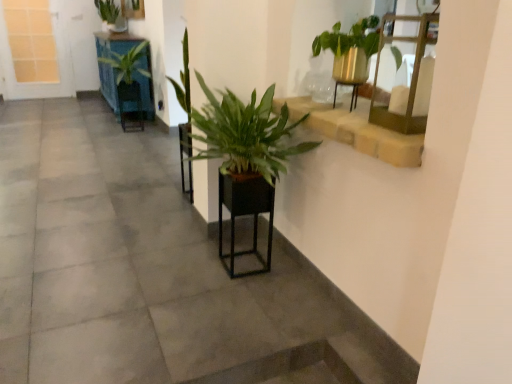
What do you see at coordinates (124, 71) in the screenshot? The image size is (512, 384). I see `green leafy plant at upper left, which ranks as the 2th houseplant in top-to-bottom order` at bounding box center [124, 71].

In the scene shown: What is the approximate width of stone textured window sill at upper right?

The width of stone textured window sill at upper right is 47.21 centimeters.

Find the location of a particular element. stone textured window sill at upper right is located at coordinates (356, 131).

Locate an element on the screen. The height and width of the screenshot is (384, 512). smooth concrete at center is located at coordinates (145, 271).

Where is `black matte planter at center, the 3th armchair positioned from the back`? The height and width of the screenshot is (384, 512). black matte planter at center, the 3th armchair positioned from the back is located at coordinates (246, 214).

Image resolution: width=512 pixels, height=384 pixels. Describe the element at coordinates (246, 214) in the screenshot. I see `black matte planter at center, which is the 3th armchair in top-to-bottom order` at that location.

I want to click on green matte plant at center, arranged as the 2th armchair when ordered from the bottom, so click(x=187, y=155).

Does point (243, 370) appear closer or farther from the camera than point (306, 146)?

Point (243, 370) appears to be closer to the viewer than point (306, 146).

From a real-world perspective, which object stands above the other?

green leafy plant at center, acting as the 3th houseplant starting from the back, from a real-world perspective.

Is brown wooden stairwell at lower center bigger than green leafy plant at center, which ranks as the third houseplant in top-to-bottom order?

Actually, brown wooden stairwell at lower center might be smaller than green leafy plant at center, which ranks as the third houseplant in top-to-bottom order.

Is stone textured window sill at upper right at the left side of green matte plant at center, the 2th armchair positioned from the back?

In fact, stone textured window sill at upper right is to the right of green matte plant at center, the 2th armchair positioned from the back.

Are stone textured window sill at upper right and green matte plant at center, the 2th armchair when ordered from top to bottom, located far from each other?

Absolutely, stone textured window sill at upper right is distant from green matte plant at center, the 2th armchair when ordered from top to bottom.

Considering the relative sizes of stone textured window sill at upper right and green matte plant at center, marked as the 2th armchair in a front-to-back arrangement, in the image provided, is stone textured window sill at upper right shorter than green matte plant at center, marked as the 2th armchair in a front-to-back arrangement,?

Yes.

Where is `window sill in front of the green matte plant at center, marked as the 2th armchair in a front-to-back arrangement`? window sill in front of the green matte plant at center, marked as the 2th armchair in a front-to-back arrangement is located at coordinates (356, 131).

From the image's perspective, which is above, green leafy plant at upper left, marked as the 1th houseplant in a top-to-bottom arrangement, or stone textured window sill at upper right?

green leafy plant at upper left, marked as the 1th houseplant in a top-to-bottom arrangement, appears higher in the image.

Is stone textured window sill at upper right surrounded by green leafy plant at upper left, which is counted as the third houseplant, starting from the right?

No, stone textured window sill at upper right is not surrounded by green leafy plant at upper left, which is counted as the third houseplant, starting from the right.

Based on the photo, is green leafy plant at upper left, acting as the first houseplant starting from the left, in front of or behind stone textured window sill at upper right in the image?

In the image, green leafy plant at upper left, acting as the first houseplant starting from the left, appears behind stone textured window sill at upper right.

Which object is positioned more to the right, green leafy plant at upper left, which ranks as the 2th houseplant in bottom-to-top order, or green leafy plant at center, acting as the 3th houseplant starting from the back?

From the viewer's perspective, green leafy plant at center, acting as the 3th houseplant starting from the back, appears more on the right side.

Is green leafy plant at center, which appears as the 1th houseplant when ordered from the bottom, a part of green leafy plant at upper left, the 2th houseplant when ordered from left to right?

That's incorrect, green leafy plant at center, which appears as the 1th houseplant when ordered from the bottom, is not inside green leafy plant at upper left, the 2th houseplant when ordered from left to right.

Considering the sizes of objects green leafy plant at upper left, the 2th houseplant when ordered from left to right, and green leafy plant at center, which ranks as the third houseplant in top-to-bottom order, in the image provided, who is taller, green leafy plant at upper left, the 2th houseplant when ordered from left to right, or green leafy plant at center, which ranks as the third houseplant in top-to-bottom order,?

With more height is green leafy plant at upper left, the 2th houseplant when ordered from left to right.

Relative to green leafy plant at center, which is counted as the first houseplant, starting from the front, is green leafy plant at upper left, the second houseplant from the back, in front or behind?

In the image, green leafy plant at upper left, the second houseplant from the back, appears behind green leafy plant at center, which is counted as the first houseplant, starting from the front.

Consider the image. Is green leafy plant at center, which appears as the 1th houseplant when viewed from the right, bigger or smaller than green leafy plant at upper left, arranged as the third houseplant when ordered from the bottom?

Considering their sizes, green leafy plant at center, which appears as the 1th houseplant when viewed from the right, takes up more space than green leafy plant at upper left, arranged as the third houseplant when ordered from the bottom.

Is green leafy plant at center, which appears as the 1th houseplant when viewed from the right, shorter than green leafy plant at upper left, marked as the 1th houseplant in a top-to-bottom arrangement?

Correct, green leafy plant at center, which appears as the 1th houseplant when viewed from the right, is not as tall as green leafy plant at upper left, marked as the 1th houseplant in a top-to-bottom arrangement.

Measure the distance from green leafy plant at center, which appears as the 1th houseplant when viewed from the right, to green leafy plant at upper left, arranged as the third houseplant when ordered from the bottom.

green leafy plant at center, which appears as the 1th houseplant when viewed from the right, is 3.38 meters away from green leafy plant at upper left, arranged as the third houseplant when ordered from the bottom.

In the image, is green leafy plant at center, which ranks as the third houseplant in top-to-bottom order, on the left side or the right side of green leafy plant at upper left, acting as the first houseplant starting from the left?

green leafy plant at center, which ranks as the third houseplant in top-to-bottom order, is positioned on green leafy plant at upper left, acting as the first houseplant starting from the left,'s right side.

Is point (94, 316) closer or farther from the camera than point (400, 164)?

Point (94, 316) appears to be farther away from the viewer than point (400, 164).

Is smooth concrete at center spatially inside stone textured window sill at upper right, or outside of it?

smooth concrete at center is outside stone textured window sill at upper right.

In terms of height, does smooth concrete at center look taller or shorter compared to stone textured window sill at upper right?

Considering their sizes, smooth concrete at center has less height than stone textured window sill at upper right.

This screenshot has height=384, width=512. I want to click on concrete above the stone textured window sill at upper right (from the image's perspective), so click(x=145, y=271).

Is green leafy plant at upper left, the third houseplant in the front-to-back sequence, positioned in front of smooth concrete at center?

No, it is behind smooth concrete at center.

Is green leafy plant at upper left, arranged as the third houseplant when ordered from the bottom, looking in the opposite direction of smooth concrete at center?

green leafy plant at upper left, arranged as the third houseplant when ordered from the bottom, is not turned away from smooth concrete at center.

Which is in front, point (118, 22) or point (329, 351)?

Point (329, 351)

Where is `houseplant that is the 1st one when counting upward from the brown wooden stairwell at lower center (from the image's perspective)`? The image size is (512, 384). houseplant that is the 1st one when counting upward from the brown wooden stairwell at lower center (from the image's perspective) is located at coordinates (240, 129).

Identify the location of the 2nd armchair behind when counting from the stone textured window sill at upper right. click(187, 155).

From the picture: Based on their spatial positions, is black matte planter at center, marked as the third armchair in a left-to-right arrangement, or green matte plant at center, the 2th armchair positioned from the back, closer to gold metallic shelf at upper right?

black matte planter at center, marked as the third armchair in a left-to-right arrangement, lies closer to gold metallic shelf at upper right than the other object.

From the image, which object appears to be nearer to white grid glass at upper left, green matte plant at center, the 2th armchair positioned from the back, or green leafy plant at upper left, which ranks as the 2th houseplant in top-to-bottom order?

Based on the image, green leafy plant at upper left, which ranks as the 2th houseplant in top-to-bottom order, appears to be nearer to white grid glass at upper left.

From the picture: When comparing their distances from green leafy plant at upper left, the third houseplant in the front-to-back sequence, does smooth concrete at center or black matte planter at center, which ranks as the first armchair in right-to-left order, seem further?

black matte planter at center, which ranks as the first armchair in right-to-left order, is positioned further to the anchor green leafy plant at upper left, the third houseplant in the front-to-back sequence.

Looking at the image, which one is located closer to brown wooden stairwell at lower center, green matte plant at center, the 2th armchair positioned from the back, or white grid glass at upper left?

The object closer to brown wooden stairwell at lower center is green matte plant at center, the 2th armchair positioned from the back.

Which object lies nearer to the anchor point green leafy plant at upper left, placed as the second houseplant when sorted from front to back, green leafy plant at center, positioned as the 3th houseplant in left-to-right order, or white grid glass at upper left?

white grid glass at upper left is closer to green leafy plant at upper left, placed as the second houseplant when sorted from front to back.

Looking at the image, which one is located further to green matte plant at center, arranged as the 2th armchair when ordered from the bottom, matte black armchair at center, placed as the third armchair when sorted from right to left, or white grid glass at upper left?

Based on the image, white grid glass at upper left appears to be further to green matte plant at center, arranged as the 2th armchair when ordered from the bottom.

When comparing their distances from smooth concrete at center, does matte black armchair at center, marked as the first armchair in a back-to-front arrangement, or white grid glass at upper left seem closer?

matte black armchair at center, marked as the first armchair in a back-to-front arrangement.

Based on their spatial positions, is green leafy plant at center, which appears as the 1th houseplant when viewed from the right, or matte black armchair at center, placed as the third armchair when sorted from right to left, further from black matte planter at center, which ranks as the first armchair in front-to-back order?

matte black armchair at center, placed as the third armchair when sorted from right to left, is further to black matte planter at center, which ranks as the first armchair in front-to-back order.

The image size is (512, 384). I want to click on stairwell located between smooth concrete at center and green leafy plant at upper left, the 2th houseplant when ordered from left to right, in the depth direction, so click(283, 366).

This screenshot has width=512, height=384. What are the coordinates of `armchair between brown wooden stairwell at lower center and green matte plant at center, arranged as the 2th armchair when ordered from the bottom, along the z-axis` in the screenshot? It's located at (246, 214).

Find the location of a particular element. The height and width of the screenshot is (384, 512). houseplant located between smooth concrete at center and brown wooden stairwell at lower center in the left-right direction is located at coordinates (240, 129).

In order to click on armchair positioned between green matte plant at center, placed as the second armchair when sorted from left to right, and green leafy plant at upper left, which appears as the 1th houseplant when viewed from the back, from near to far in this screenshot , I will do `click(130, 101)`.